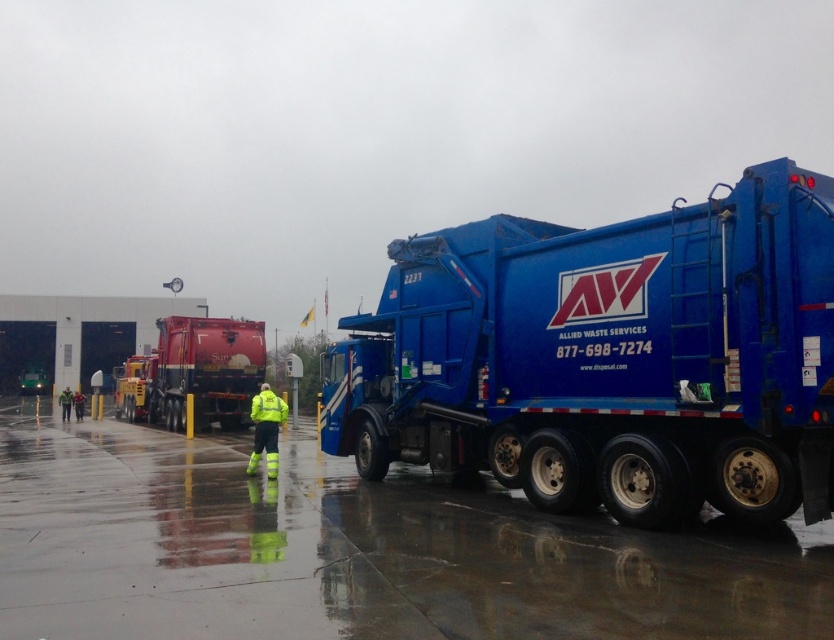
Is blue matte/glossy garbage truck at right thinner than high visibility yellow safety vest at center?

No, blue matte/glossy garbage truck at right is not thinner than high visibility yellow safety vest at center.

Image resolution: width=834 pixels, height=640 pixels. What do you see at coordinates (609, 356) in the screenshot?
I see `blue matte/glossy garbage truck at right` at bounding box center [609, 356].

I want to click on blue matte/glossy garbage truck at right, so click(609, 356).

Can you confirm if blue matte/glossy garbage truck at right is smaller than red glossy truck at center?

Yes, blue matte/glossy garbage truck at right is smaller than red glossy truck at center.

Is point (466, 422) farther from camera compared to point (203, 396)?

No.

Does point (451, 376) lie behind point (259, 337)?

No, it is in front of (259, 337).

Find the location of a particular element. The image size is (834, 640). blue matte/glossy garbage truck at right is located at coordinates (609, 356).

Who is more forward, (217,328) or (265,397)?

Point (265,397) is more forward.

Is red glossy truck at center to the left of high visibility yellow safety vest at center from the viewer's perspective?

Indeed, red glossy truck at center is positioned on the left side of high visibility yellow safety vest at center.

This screenshot has width=834, height=640. Identify the location of red glossy truck at center. (194, 372).